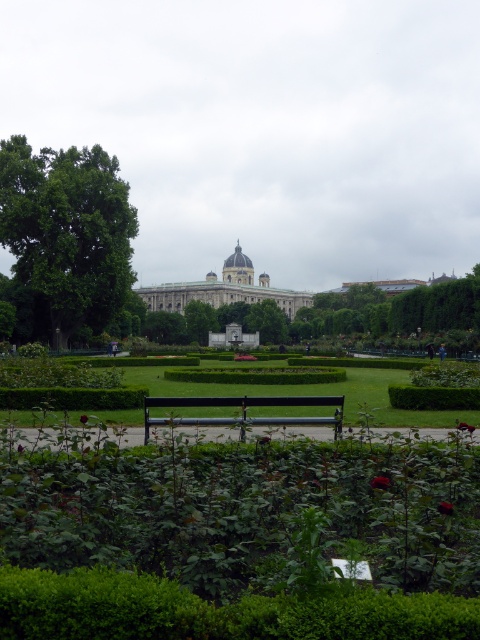
You are standing in the park and want to take a photo of the green matte bench at center and the white stone building at center. Which object will appear larger in the photo?

The green matte bench at center will appear larger in the photo because it is closer to the viewer than the white stone building at center.